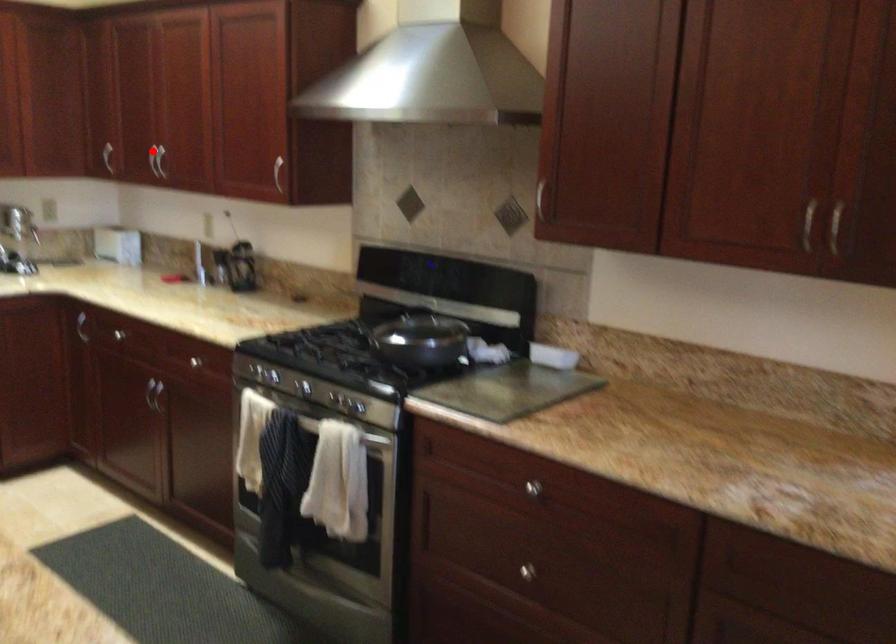
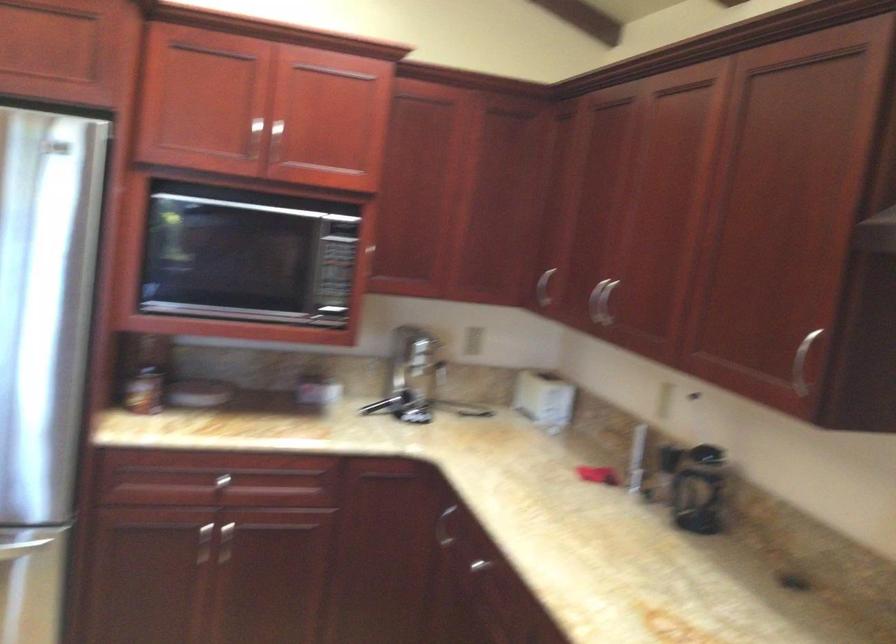
Question: A red point is marked in image1. In image2, is the corresponding 3D point closer to the camera or farther? Reply with the corresponding letter.

Choices:
 (A) The corresponding 3D point is closer.
 (B) The corresponding 3D point is farther.

Answer: (A)